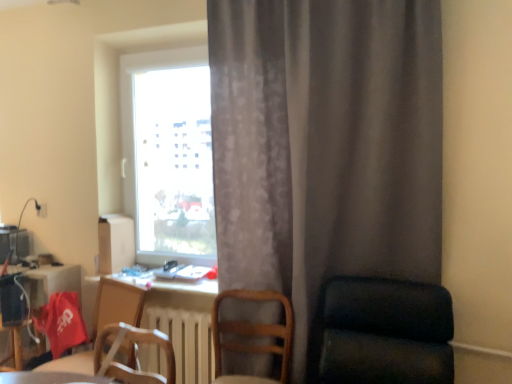
Question: Is dark green fabric chair at right, which is counted as the third chair, starting from the left, outside transparent glass window at center?

Choices:
 (A) no
 (B) yes

Answer: (B)

Question: Does dark green fabric chair at right, which appears as the first chair when viewed from the right, have a greater height compared to transparent glass window at center?

Choices:
 (A) no
 (B) yes

Answer: (A)

Question: Is dark green fabric chair at right, which is counted as the third chair, starting from the left, smaller than transparent glass window at center?

Choices:
 (A) yes
 (B) no

Answer: (B)

Question: From the image's perspective, is dark green fabric chair at right, which is counted as the third chair, starting from the left, on top of transparent glass window at center?

Choices:
 (A) yes
 (B) no

Answer: (B)

Question: Is transparent glass window at center completely or partially inside dark green fabric chair at right, which appears as the first chair when viewed from the right?

Choices:
 (A) yes
 (B) no

Answer: (B)

Question: Can you confirm if dark green fabric chair at right, which is counted as the third chair, starting from the left, is wider than transparent glass window at center?

Choices:
 (A) no
 (B) yes

Answer: (B)

Question: Considering the relative sizes of gray textured curtain at center and wooden chair at lower center, the second chair from the left, in the image provided, is gray textured curtain at center wider than wooden chair at lower center, the second chair from the left,?

Choices:
 (A) no
 (B) yes

Answer: (A)

Question: From a real-world perspective, is gray textured curtain at center located higher than wooden chair at lower center, the 2th chair viewed from the right?

Choices:
 (A) yes
 (B) no

Answer: (A)

Question: Does gray textured curtain at center turn towards wooden chair at lower center, the second chair from the left?

Choices:
 (A) no
 (B) yes

Answer: (B)

Question: Can wooden chair at lower center, the second chair from the left, be found inside gray textured curtain at center?

Choices:
 (A) no
 (B) yes

Answer: (A)

Question: From the image's perspective, is gray textured curtain at center beneath wooden chair at lower center, the second chair from the left?

Choices:
 (A) yes
 (B) no

Answer: (B)

Question: Is gray textured curtain at center shorter than wooden chair at lower center, the second chair from the left?

Choices:
 (A) yes
 (B) no

Answer: (B)

Question: Considering the relative sizes of transparent glass window at center and white glossy table at lower left in the image provided, is transparent glass window at center wider than white glossy table at lower left?

Choices:
 (A) no
 (B) yes

Answer: (A)